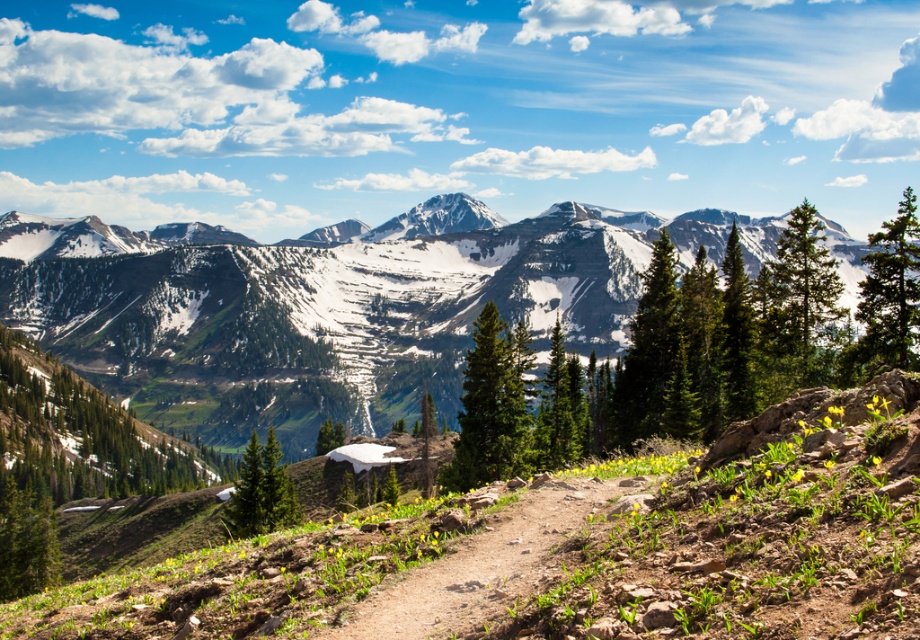
You are a hiker planning to take the brown dirt path at center to reach the snowy granite mountains at center. According to the map, the path is 2 kilometers long. If you walk at a steady pace of 4 km per hour, how long will it take you to reach the mountains?

The snowy granite mountains at center are above the brown dirt path at center, so you can see them from the path. However, the path is only 2 kilometers long, so at 4 km per hour, it would take 30 minutes to reach the end of the path. However, the mountains themselves may be further away or require a different route not indicated by the path length.

Based on the photo, you are standing at the starting point of the dirt path in the rugged terrain. You see a point marked at coordinates (330,305). What does this point indicate in the scene?

The point at coordinates (330,305) indicates the location of the snowy granite mountains at center.

You are planning a hiking route and need to decide whether to prioritize the snowy granite mountains at center or the brown dirt path at center based on their sizes. Which one should you focus on first according to their sizes?

The snowy granite mountains at center is larger in size than the brown dirt path at center, so you should focus on the snowy granite mountains at center first.